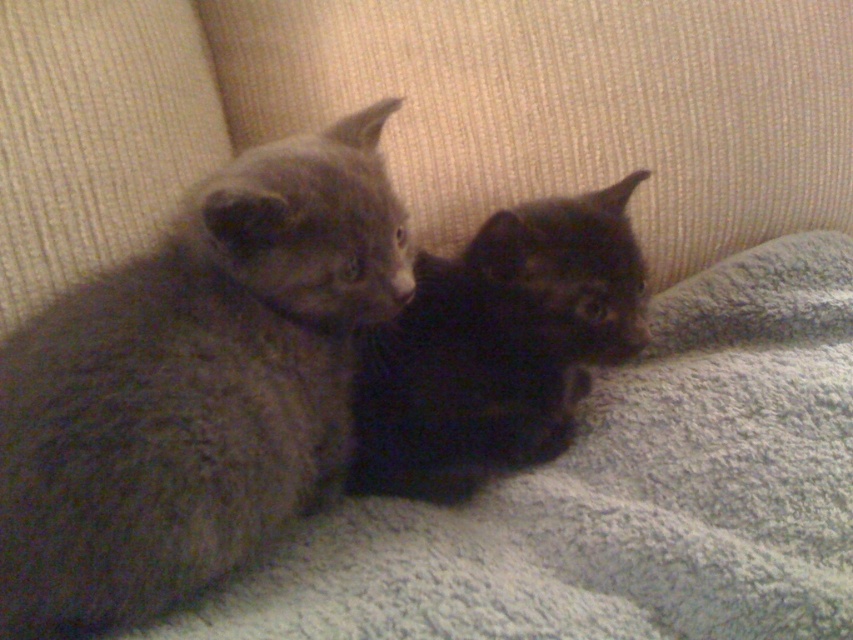
Can you confirm if soft gray fur kitten at left is positioned above black fuzzy cat at center?

Incorrect, soft gray fur kitten at left is not positioned above black fuzzy cat at center.

Is soft gray fur kitten at left shorter than black fuzzy cat at center?

No, soft gray fur kitten at left is not shorter than black fuzzy cat at center.

The width and height of the screenshot is (853, 640). I want to click on soft gray fur kitten at left, so click(x=195, y=385).

The height and width of the screenshot is (640, 853). In order to click on soft gray fur kitten at left in this screenshot , I will do `click(195, 385)`.